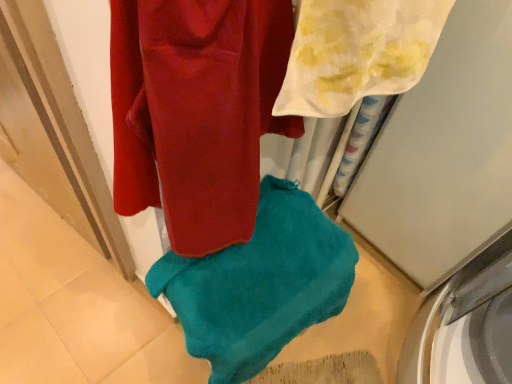
Question: Is white sheer towel at upper right, positioned as the 2th towel in bottom-to-top order, in contact with white glossy washing machine at lower right?

Choices:
 (A) no
 (B) yes

Answer: (A)

Question: Is white sheer towel at upper right, marked as the 2th towel in a back-to-front arrangement, further to camera compared to white glossy washing machine at lower right?

Choices:
 (A) yes
 (B) no

Answer: (B)

Question: Does white sheer towel at upper right, marked as the 2th towel in a back-to-front arrangement, have a greater width compared to white glossy washing machine at lower right?

Choices:
 (A) yes
 (B) no

Answer: (B)

Question: From the image's perspective, is white sheer towel at upper right, positioned as the 1th towel in top-to-bottom order, above white glossy washing machine at lower right?

Choices:
 (A) no
 (B) yes

Answer: (B)

Question: Considering the relative sizes of white sheer towel at upper right, positioned as the 2th towel in bottom-to-top order, and white glossy washing machine at lower right in the image provided, is white sheer towel at upper right, positioned as the 2th towel in bottom-to-top order, shorter than white glossy washing machine at lower right?

Choices:
 (A) yes
 (B) no

Answer: (B)

Question: Could you tell me if white sheer towel at upper right, marked as the 2th towel in a back-to-front arrangement, is turned towards white glossy washing machine at lower right?

Choices:
 (A) no
 (B) yes

Answer: (A)

Question: From a real-world perspective, is white sheer towel at upper right, placed as the first towel when sorted from front to back, positioned over teal soft towel at center, placed as the second towel when sorted from top to bottom, based on gravity?

Choices:
 (A) yes
 (B) no

Answer: (A)

Question: Considering the relative sizes of white sheer towel at upper right, positioned as the 1th towel in top-to-bottom order, and teal soft towel at center, which appears as the 1th towel when viewed from the back, in the image provided, is white sheer towel at upper right, positioned as the 1th towel in top-to-bottom order, bigger than teal soft towel at center, which appears as the 1th towel when viewed from the back,?

Choices:
 (A) no
 (B) yes

Answer: (A)

Question: Is white sheer towel at upper right, positioned as the 2th towel in bottom-to-top order, directly adjacent to teal soft towel at center, which ranks as the 1th towel in bottom-to-top order?

Choices:
 (A) yes
 (B) no

Answer: (B)

Question: Is white sheer towel at upper right, placed as the first towel when sorted from front to back, at the right side of teal soft towel at center, which ranks as the 1th towel in bottom-to-top order?

Choices:
 (A) yes
 (B) no

Answer: (A)

Question: Is white sheer towel at upper right, positioned as the 1th towel in top-to-bottom order, oriented towards teal soft towel at center, which appears as the second towel when viewed from the front?

Choices:
 (A) no
 (B) yes

Answer: (A)

Question: Is white sheer towel at upper right, positioned as the 1th towel in top-to-bottom order, shorter than teal soft towel at center, which ranks as the 1th towel in bottom-to-top order?

Choices:
 (A) no
 (B) yes

Answer: (A)

Question: Is white glossy washing machine at lower right shorter than teal soft towel at center, which ranks as the 1th towel in bottom-to-top order?

Choices:
 (A) no
 (B) yes

Answer: (B)